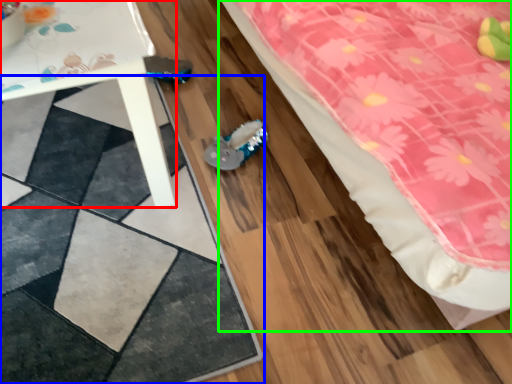
Question: Considering the real-world distances, which object is farthest from table (highlighted by a red box)? square (highlighted by a blue box) or bed (highlighted by a green box)?

Choices:
 (A) square
 (B) bed

Answer: (B)